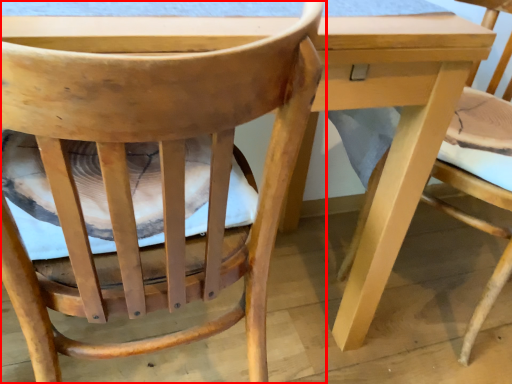
Question: From the image's perspective, considering the relative positions of chair (annotated by the red box) and chair in the image provided, where is chair (annotated by the red box) located with respect to the staircase?

Choices:
 (A) above
 (B) below

Answer: (B)